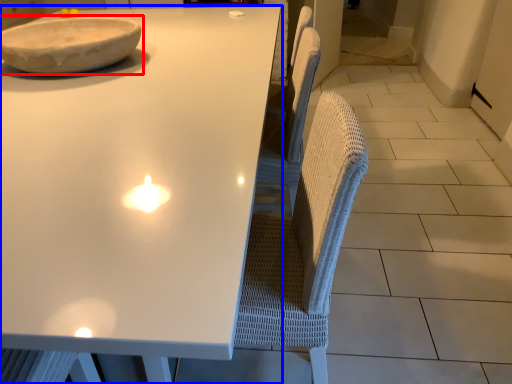
Question: Which object appears closest to the camera in this image, bowl (highlighted by a red box) or table (highlighted by a blue box)?

Choices:
 (A) bowl
 (B) table

Answer: (B)